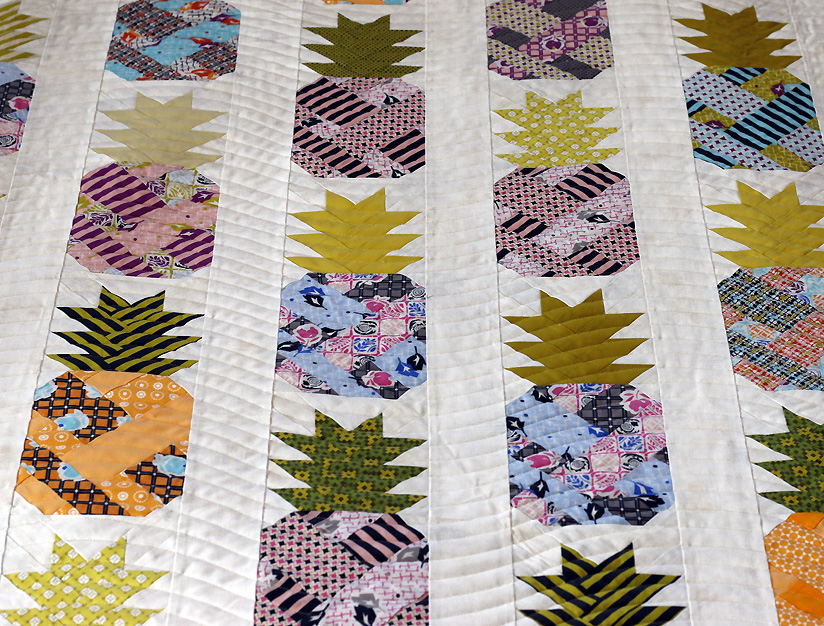
Locate an element on the screen. The width and height of the screenshot is (824, 626). quilt is located at coordinates point(461,471).